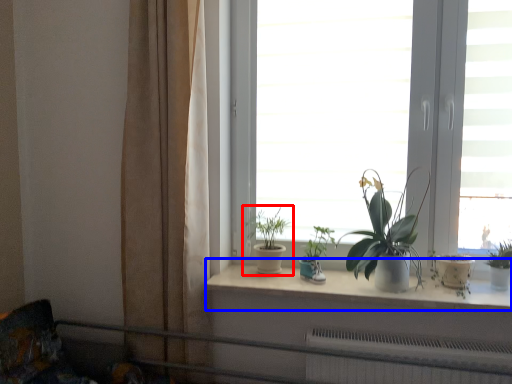
Question: Which object is closer to the camera taking this photo, houseplant (highlighted by a red box) or window sill (highlighted by a blue box)?

Choices:
 (A) houseplant
 (B) window sill

Answer: (B)